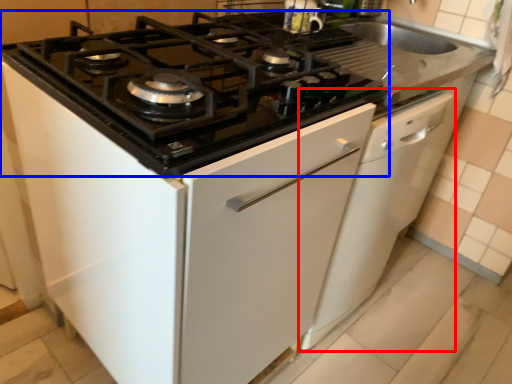
Question: Among these objects, which one is nearest to the camera, dish washer (highlighted by a red box) or gas stove (highlighted by a blue box)?

Choices:
 (A) dish washer
 (B) gas stove

Answer: (B)